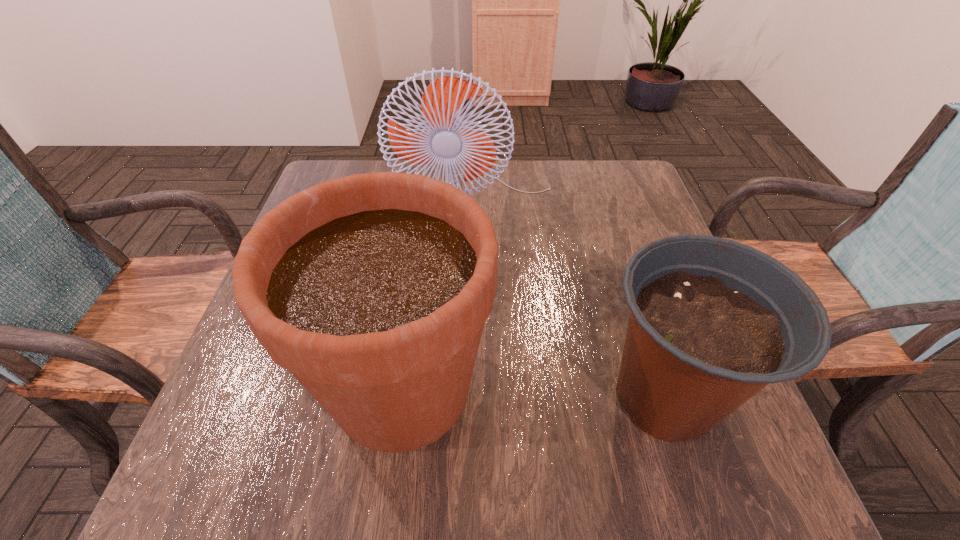
Locate an element on the screen. Image resolution: width=960 pixels, height=540 pixels. object that is at the left edge is located at coordinates (372, 289).

Identify the location of object that is positioned at the right edge. This screenshot has width=960, height=540. (712, 321).

Where is `object positioned at the near left corner`? The width and height of the screenshot is (960, 540). object positioned at the near left corner is located at coordinates (372, 289).

Find the location of a particular element. The width and height of the screenshot is (960, 540). object present at the near right corner is located at coordinates (712, 321).

This screenshot has width=960, height=540. In the image, there is a desktop. Identify the location of vacant space at the far edge. (545, 190).

In the image, there is a desktop. Where is `vacant space at the left edge`? vacant space at the left edge is located at coordinates (211, 420).

I want to click on vacant region at the near left corner of the desktop, so click(x=236, y=488).

Locate an element on the screen. vacant region between the farthest object and the shortest object is located at coordinates (573, 305).

Locate an element on the screen. The width and height of the screenshot is (960, 540). vacant area that lies between the right flowerpot and the tallest object is located at coordinates (573, 305).

The height and width of the screenshot is (540, 960). In order to click on free space that is in between the shortest object and the tallest object in this screenshot , I will do `click(573, 305)`.